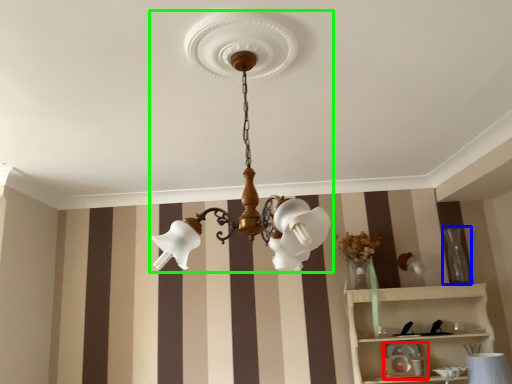
Question: Considering the real-world distances, which object is closest to toy (highlighted by a red box)? vase (highlighted by a blue box) or lamp (highlighted by a green box).

Choices:
 (A) vase
 (B) lamp

Answer: (A)